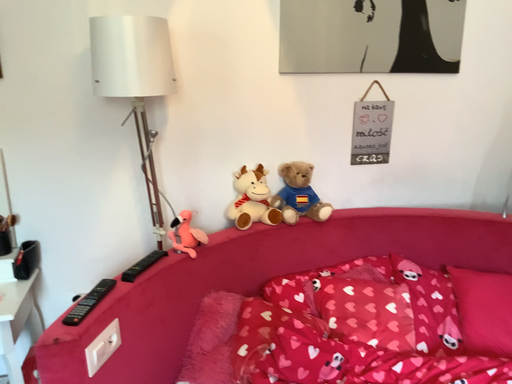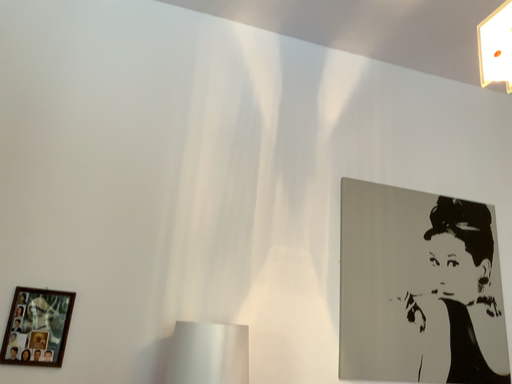
Question: Which way did the camera rotate in the video?

Choices:
 (A) rotated upward
 (B) rotated downward

Answer: (A)